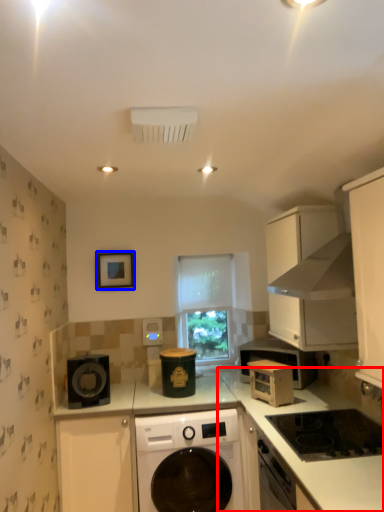
Question: Which object appears closest to the camera in this image, counter top (highlighted by a red box) or picture frame (highlighted by a blue box)?

Choices:
 (A) counter top
 (B) picture frame

Answer: (A)